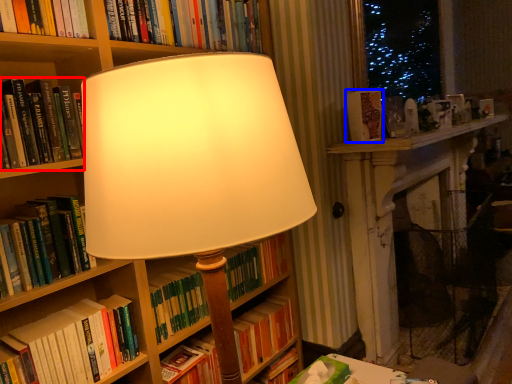
Question: Which point is closer to the camera, book (highlighted by a red box) or book (highlighted by a blue box)?

Choices:
 (A) book
 (B) book

Answer: (A)